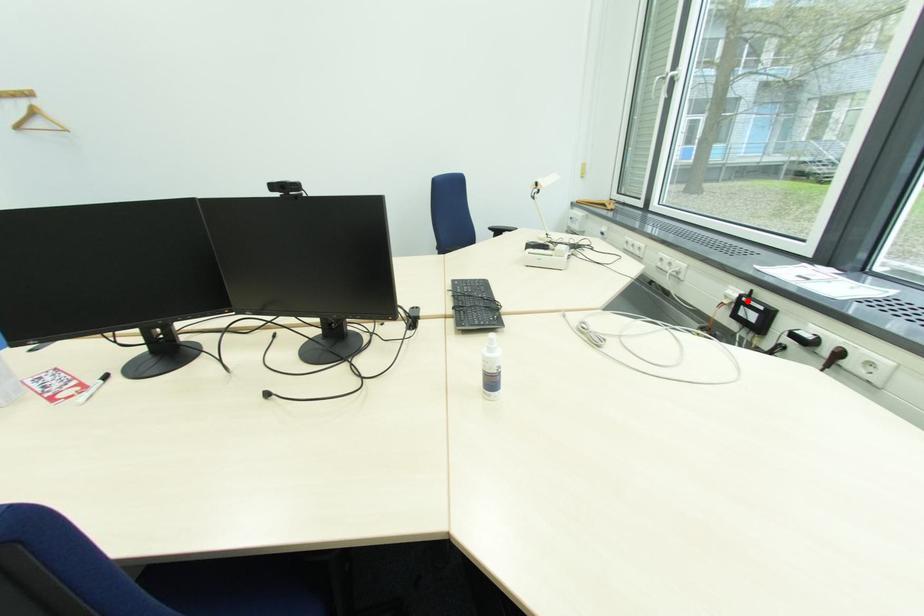
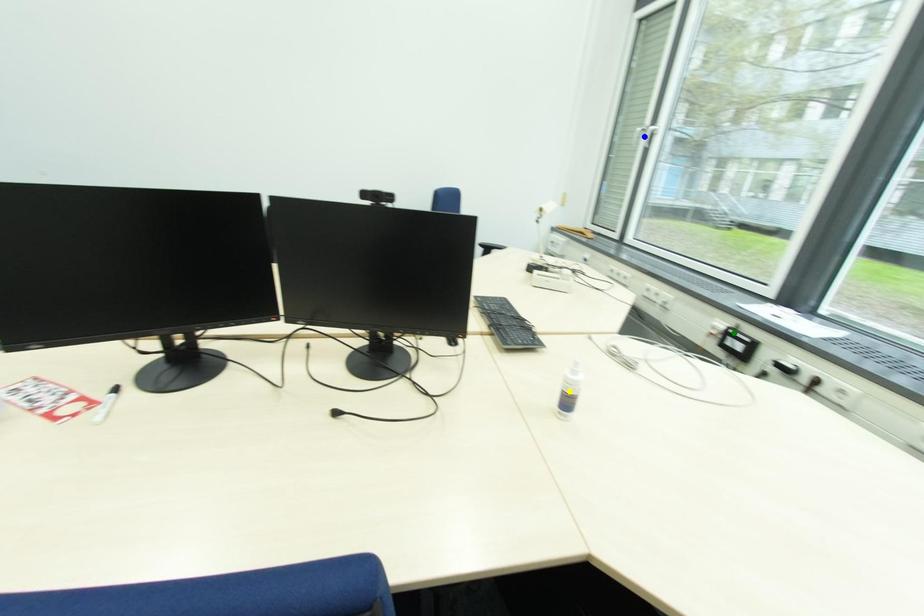
Question: I am providing you with two images of the same scene from different viewpoints. A red point is marked on the first image. You are given multiple points on the second image. Which spot in image 2 lines up with the point in image 1?

Choices:
 (A) blue point
 (B) green point
 (C) yellow point

Answer: (B)